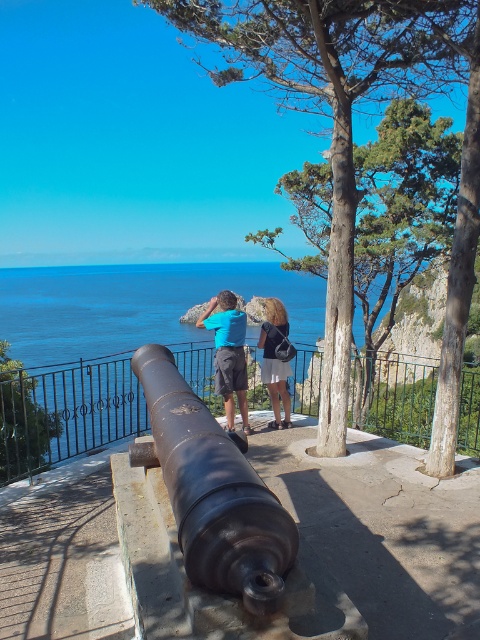
Which is more to the right, rusty metal cannon at center or matte black backpack at center?

From the viewer's perspective, matte black backpack at center appears more on the right side.

Which is in front, point (226, 582) or point (276, 401)?

Point (226, 582) is more forward.

Where is `rusty metal cannon at center`? rusty metal cannon at center is located at coordinates (214, 490).

Can you confirm if blue water at center is bigger than rusty metal cannon at center?

Correct, blue water at center is larger in size than rusty metal cannon at center.

Which is more to the right, blue water at center or rusty metal cannon at center?

Positioned to the right is rusty metal cannon at center.

Is point (359, 332) less distant than point (193, 548)?

No, (359, 332) is further to viewer.

Find the location of `blue water at center`. blue water at center is located at coordinates (136, 305).

Is point (212, 456) positioned after point (204, 326)?

No, it is not.

Who is taller, rusty metal cannon at center or blue fabric shirt at center?

With more height is blue fabric shirt at center.

Locate an element on the screen. Image resolution: width=480 pixels, height=640 pixels. rusty metal cannon at center is located at coordinates (214, 490).